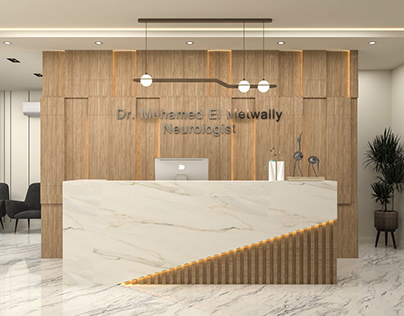
Where is `chair`? The image size is (404, 316). chair is located at coordinates (31, 205).